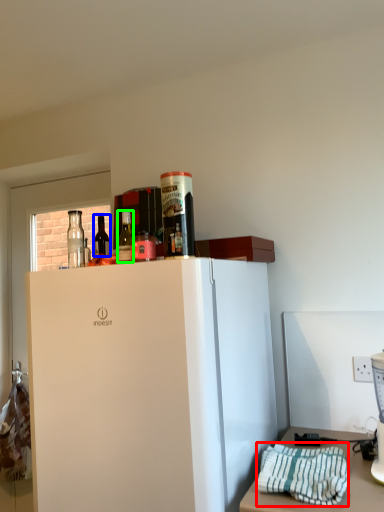
Question: Which is nearer to the blanket (highlighted by a red box)? bottle (highlighted by a blue box) or bottle (highlighted by a green box).

Choices:
 (A) bottle
 (B) bottle

Answer: (B)